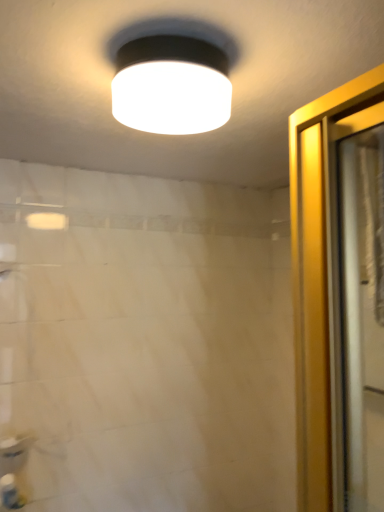
What is the approximate width of translucent plastic shower curtain at right?

It is 1.94 inches.

Locate an element on the screen. This screenshot has height=512, width=384. white matte lampshade at upper center is located at coordinates 171,85.

Is translucent plastic shower curtain at right thinner than white glossy sink at lower left?

Yes.

From the picture: Is translucent plastic shower curtain at right located outside white glossy sink at lower left?

translucent plastic shower curtain at right is positioned outside white glossy sink at lower left.

Is translucent plastic shower curtain at right taller or shorter than white glossy sink at lower left?

Clearly, translucent plastic shower curtain at right is taller compared to white glossy sink at lower left.

Is the surface of white glossy sink at lower left in direct contact with white plastic bottle at lower left?

Yes, white glossy sink at lower left is next to white plastic bottle at lower left.

Based on the photo, is white glossy sink at lower left facing away from white plastic bottle at lower left?

No, white glossy sink at lower left is not facing away from white plastic bottle at lower left.

Looking at their sizes, would you say white glossy sink at lower left is wider or thinner than white plastic bottle at lower left?

Clearly, white glossy sink at lower left has less width compared to white plastic bottle at lower left.

How different are the orientations of white glossy sink at lower left and white plastic bottle at lower left in degrees?

The facing directions of white glossy sink at lower left and white plastic bottle at lower left are 0.00218 degrees apart.

From a real-world perspective, is white matte lampshade at upper center beneath white plastic bottle at lower left?

No, from a real-world perspective, white matte lampshade at upper center is not below white plastic bottle at lower left.

Is white matte lampshade at upper center at the right side of white plastic bottle at lower left?

Yes.

Does point (199, 106) lie in front of point (10, 496)?

Yes, point (199, 106) is in front of point (10, 496).

Is white glossy sink at lower left situated inside white matte lampshade at upper center or outside?

white glossy sink at lower left is outside white matte lampshade at upper center.

Consider the image. From a real-world perspective, which object rests below the other?

white glossy sink at lower left is physically lower.

Based on the photo, considering the sizes of objects white glossy sink at lower left and white matte lampshade at upper center in the image provided, who is smaller, white glossy sink at lower left or white matte lampshade at upper center?

With smaller size is white glossy sink at lower left.

Identify the location of sink on the left of white matte lampshade at upper center. The image size is (384, 512). (14, 452).

Is white plastic bottle at lower left in contact with white matte lampshade at upper center?

No, white plastic bottle at lower left is not next to white matte lampshade at upper center.

From the image's perspective, is white plastic bottle at lower left over white matte lampshade at upper center?

Incorrect, from the image's perspective, white plastic bottle at lower left is lower than white matte lampshade at upper center.

Can you confirm if white plastic bottle at lower left is positioned to the left of white matte lampshade at upper center?

Indeed, white plastic bottle at lower left is positioned on the left side of white matte lampshade at upper center.

Based on the photo, is white glossy sink at lower left surrounded by white plastic bottle at lower left?

No, white glossy sink at lower left is not a part of white plastic bottle at lower left.

Measure the distance between white plastic bottle at lower left and white glossy sink at lower left.

The distance of white plastic bottle at lower left from white glossy sink at lower left is 3.11 inches.

From a real-world perspective, which is physically below, white plastic bottle at lower left or white glossy sink at lower left?

white plastic bottle at lower left, from a real-world perspective.

Is white plastic bottle at lower left to the left of white glossy sink at lower left from the viewer's perspective?

In fact, white plastic bottle at lower left is to the right of white glossy sink at lower left.

Is translucent plastic shower curtain at right at the right side of white matte lampshade at upper center?

Yes, translucent plastic shower curtain at right is to the right of white matte lampshade at upper center.

Is translucent plastic shower curtain at right positioned with its back to white matte lampshade at upper center?

No, white matte lampshade at upper center is not at the back of translucent plastic shower curtain at right.

Are translucent plastic shower curtain at right and white matte lampshade at upper center located far from each other?

They are positioned close to each other.

Is point (367, 236) positioned in front of point (231, 95)?

Yes, point (367, 236) is closer to viewer.

The width and height of the screenshot is (384, 512). What are the coordinates of `sink to the left of translucent plastic shower curtain at right` in the screenshot? It's located at (14, 452).

Image resolution: width=384 pixels, height=512 pixels. I want to click on sink lying behind the white plastic bottle at lower left, so click(x=14, y=452).

Looking at the image, which one is located closer to white glossy sink at lower left, white matte lampshade at upper center or white plastic bottle at lower left?

The object closer to white glossy sink at lower left is white plastic bottle at lower left.

Estimate the real-world distances between objects in this image. Which object is closer to white plastic bottle at lower left, translucent plastic shower curtain at right or white matte lampshade at upper center?

white matte lampshade at upper center is positioned closer to the anchor white plastic bottle at lower left.

Which object lies nearer to the anchor point white glossy sink at lower left, white plastic bottle at lower left or translucent plastic shower curtain at right?

The object closer to white glossy sink at lower left is white plastic bottle at lower left.

Which object lies further to the anchor point white plastic bottle at lower left, white matte lampshade at upper center or translucent plastic shower curtain at right?

translucent plastic shower curtain at right lies further to white plastic bottle at lower left than the other object.

Looking at the image, which one is located further to white glossy sink at lower left, translucent plastic shower curtain at right or white plastic bottle at lower left?

translucent plastic shower curtain at right.

Looking at the image, which one is located closer to white plastic bottle at lower left, white matte lampshade at upper center or white glossy sink at lower left?

white glossy sink at lower left is positioned closer to the anchor white plastic bottle at lower left.

Considering their positions, is white glossy sink at lower left positioned further to translucent plastic shower curtain at right than white plastic bottle at lower left?

white plastic bottle at lower left is further to translucent plastic shower curtain at right.

In the scene shown: From the image, which object appears to be nearer to white glossy sink at lower left, white matte lampshade at upper center or translucent plastic shower curtain at right?

Based on the image, white matte lampshade at upper center appears to be nearer to white glossy sink at lower left.

At what (x,y) coordinates should I click in order to perform the action: click on shower curtain between white matte lampshade at upper center and white plastic bottle at lower left in the up-down direction. Please return your answer as a coordinate pair (x, y). Image resolution: width=384 pixels, height=512 pixels. Looking at the image, I should click on (373, 219).

Locate an element on the screen. This screenshot has height=512, width=384. sink between white matte lampshade at upper center and white plastic bottle at lower left vertically is located at coordinates pyautogui.click(x=14, y=452).

Find the location of `toiletry between white glossy sink at lower left and translucent plastic shower curtain at right from left to right`. toiletry between white glossy sink at lower left and translucent plastic shower curtain at right from left to right is located at coordinates (10, 493).

Locate an element on the screen. lamp between white glossy sink at lower left and translucent plastic shower curtain at right in the horizontal direction is located at coordinates (171, 85).